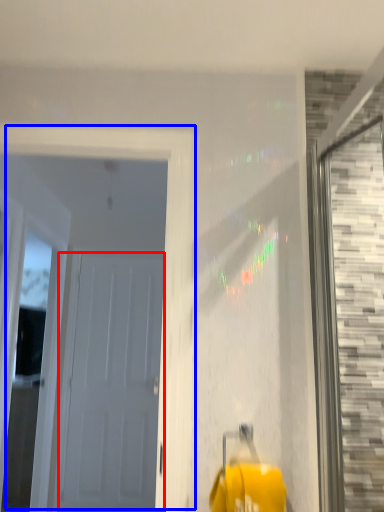
Question: Which of the following is the farthest to the observer, door (highlighted by a red box) or door (highlighted by a blue box)?

Choices:
 (A) door
 (B) door

Answer: (A)